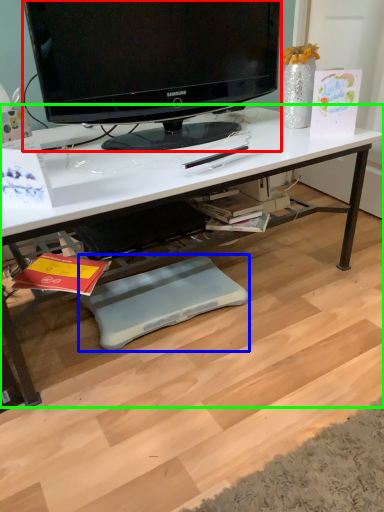
Question: Considering the real-world distances, which object is farthest from television (highlighted by a red box)? footrest (highlighted by a blue box) or desk (highlighted by a green box)?

Choices:
 (A) footrest
 (B) desk

Answer: (A)